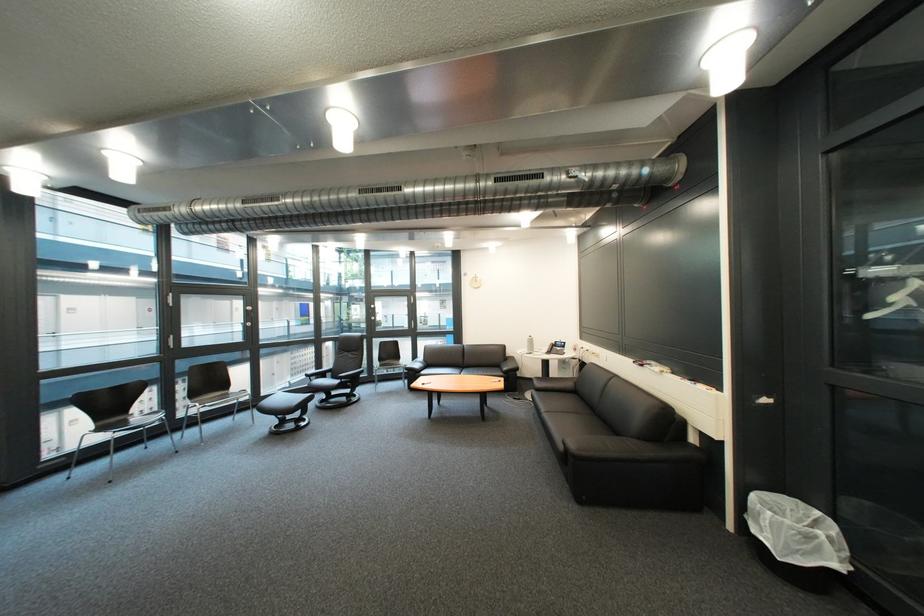
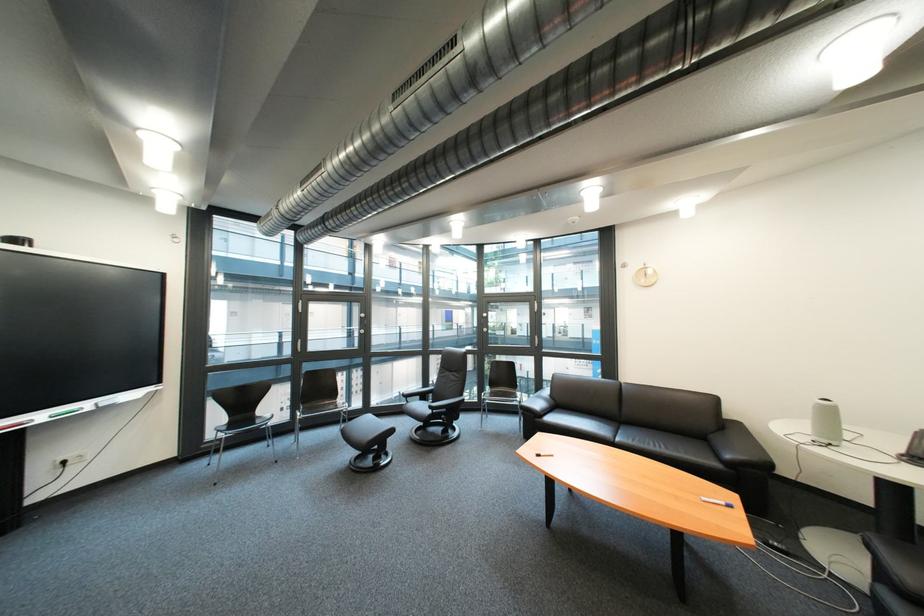
Question: I am providing you with two images of the same scene from different viewpoints. Which of the following objects are not visible in image2?

Choices:
 (A) black sofa sitting surface
 (B) silver window handle
 (C) blue table marker
 (D) none of these

Answer: (D)